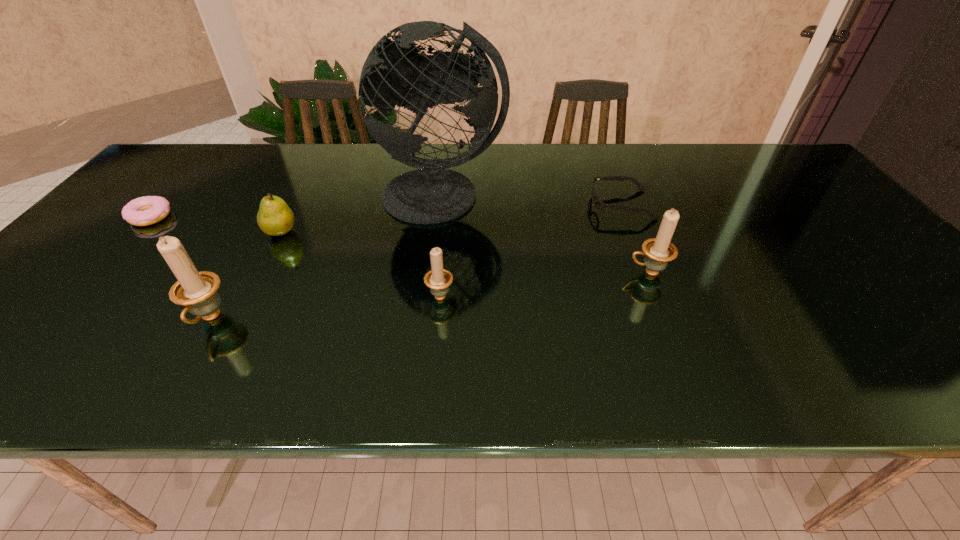
I want to click on vacant space located 0.180m on the handle side of the shortest candle_holder, so click(x=445, y=233).

Identify the location of vacant region located on the handle side of the shortest candle_holder. coord(446,228).

Locate an element on the screen. Image resolution: width=960 pixels, height=540 pixels. free space located 0.200m on the handle side of the shortest candle_holder is located at coordinates (446, 228).

Where is `blank area located on the handle side of the fifth shortest object`? This screenshot has height=540, width=960. blank area located on the handle side of the fifth shortest object is located at coordinates (537, 272).

The image size is (960, 540). I want to click on free space located 0.100m on the handle side of the fifth shortest object, so click(x=585, y=272).

At what (x,y) coordinates should I click in order to perform the action: click on blank space located on the handle side of the fifth shortest object. Please return your answer as a coordinate pair (x, y). Looking at the image, I should click on (597, 272).

The image size is (960, 540). Identify the location of free space located 0.050m on the right of the doughnut. click(x=190, y=217).

Where is `vacant region located 0.050m on the front-facing side of the tallest object`? The image size is (960, 540). vacant region located 0.050m on the front-facing side of the tallest object is located at coordinates (437, 245).

Where is `vacant space located on the back of the pear`? vacant space located on the back of the pear is located at coordinates (313, 170).

The width and height of the screenshot is (960, 540). Find the location of `vacant space situated 0.210m on the front-facing side of the spectacles`. vacant space situated 0.210m on the front-facing side of the spectacles is located at coordinates (515, 205).